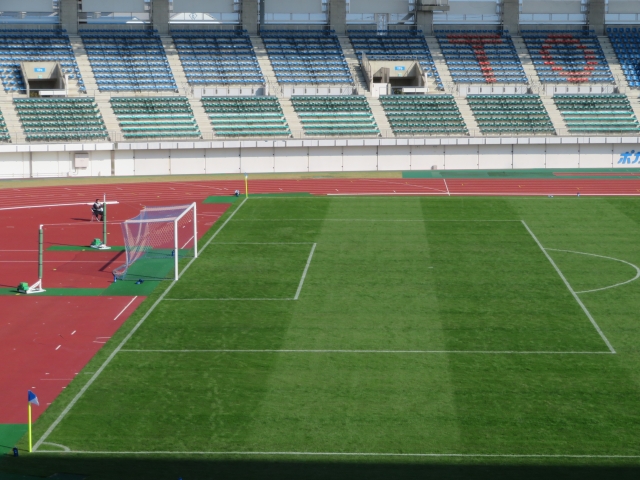
I want to click on blue seating, so click(x=550, y=64).